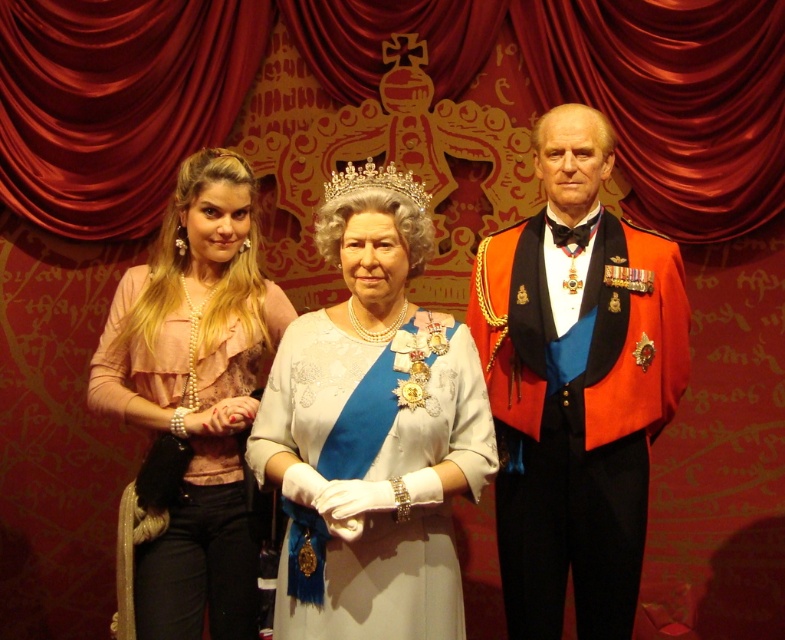
You are a photographer positioned at the center of the scene. You need to capture a closeup of the white satin dress at center. Where should you point your camera?

Point your camera towards the coordinates at point (x=371, y=438) to capture the white satin dress at center.

You are a museum security guard checking the positioning of the royal display. According to the museum guidelines, the gold metallic tiara at center must be placed above the matte white wax figure at center to ensure proper historical accuracy. Does the current arrangement meet this requirement?

Yes, the current arrangement meets the requirement because the matte white wax figure at center is positioned under the gold metallic tiara at center, which means the tiara is above the figure as required.

You are a museum curator checking the display. The matte white wax figure at center and the gold metallic tiara at center are both part of the exhibit. If you need to place them side by side on a shelf that can only accommodate the wider of the two, which object should be prioritized to fit?

The matte white wax figure at center is wider than the gold metallic tiara at center, so the shelf should prioritize accommodating the matte white wax figure at center first.